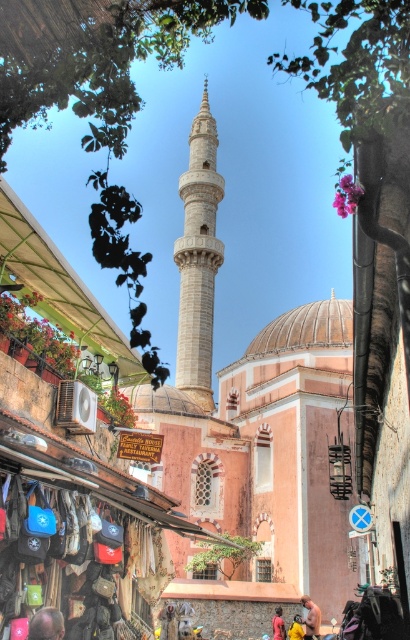
Question: Does white stone minaret at center appear on the right side of yellow fabric bag at center?

Choices:
 (A) yes
 (B) no

Answer: (B)

Question: Does smooth bald head at center lie in front of beige fabric shirt at center?

Choices:
 (A) yes
 (B) no

Answer: (A)

Question: Which object is closer to the camera taking this photo?

Choices:
 (A) beige fabric shirt at center
 (B) yellow fabric bag at center
 (C) dark blue shirt at lower center

Answer: (A)

Question: Can you confirm if white stone minaret at center is positioned to the left of beige fabric shirt at center?

Choices:
 (A) yes
 (B) no

Answer: (A)

Question: Which object is farther from the camera taking this photo?

Choices:
 (A) yellow fabric bag at center
 (B) beige fabric shirt at center
 (C) smooth bald head at center

Answer: (A)

Question: Which point is farther from the camera taking this photo?

Choices:
 (A) (296, 624)
 (B) (307, 600)
 (C) (273, 636)
 (D) (63, 627)

Answer: (C)